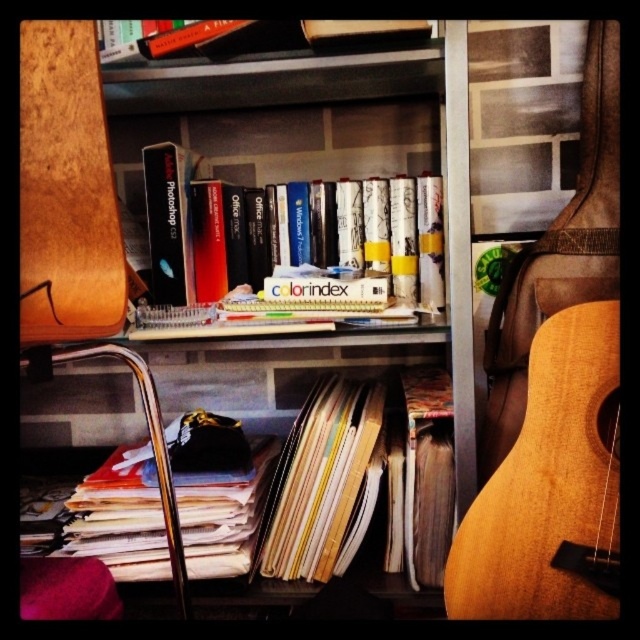
Question: Which point is farther to the camera?

Choices:
 (A) (604, 317)
 (B) (349, 465)
 (C) (45, 342)

Answer: (B)

Question: Is white matte book at center to the left of wooden bookcase at upper center from the viewer's perspective?

Choices:
 (A) yes
 (B) no

Answer: (B)

Question: Which object is closer to the camera taking this photo?

Choices:
 (A) white paper stack at lower left
 (B) natural wood guitar at right

Answer: (B)

Question: Can you confirm if white paper stack at lower left is positioned to the left of white matte book at center?

Choices:
 (A) yes
 (B) no

Answer: (A)

Question: Does natural wood guitar at right have a larger size compared to wooden bookcase at upper center?

Choices:
 (A) yes
 (B) no

Answer: (B)

Question: Which of the following is the closest to the observer?

Choices:
 (A) (422, 220)
 (B) (492, 572)

Answer: (B)